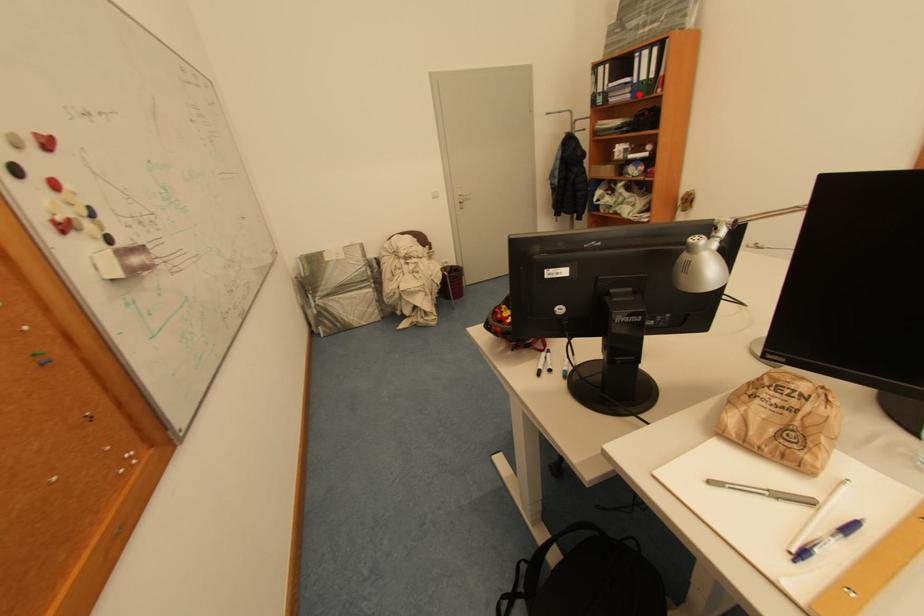
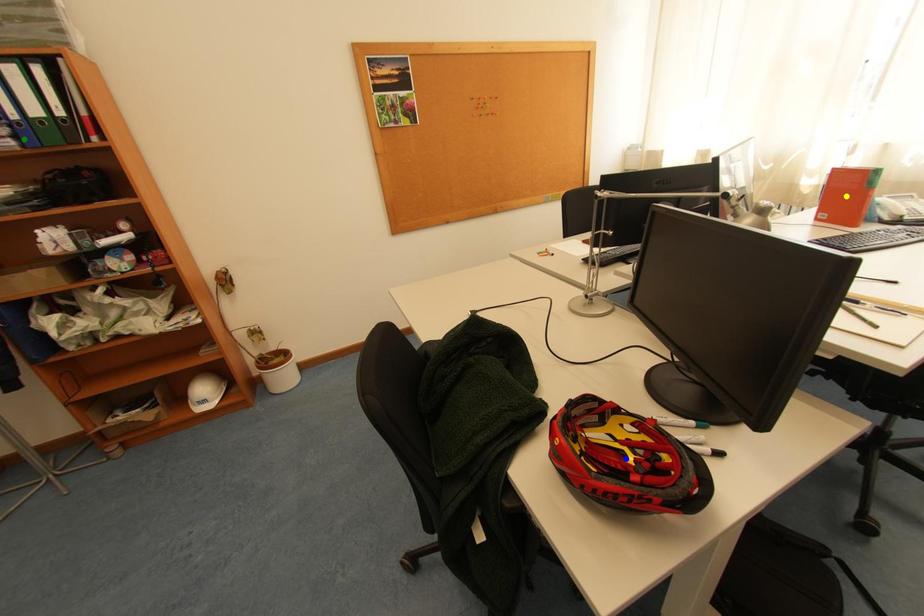
Question: I am providing you with two images of the same scene from different viewpoints. A red point is marked on the first image. You are given multiple points on the second image. Which mark in image 2 goes with the point in image 1?

Choices:
 (A) blue point
 (B) green point
 (C) yellow point

Answer: (B)